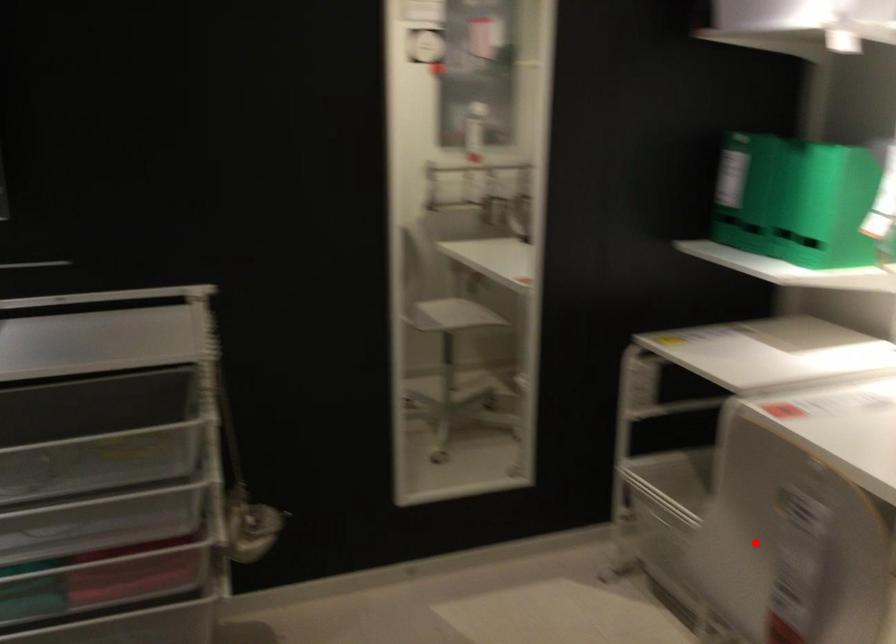
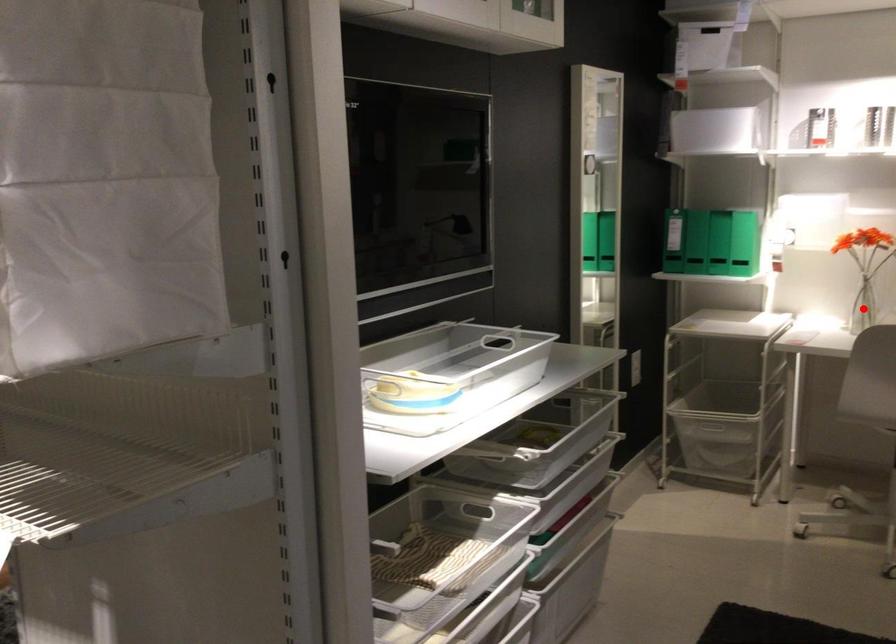
I am providing you with two images of the same scene from different viewpoints. A red point is marked on the first image and another point is marked on the second image. Is the red point in image1 aligned with the point shown in image2?

No